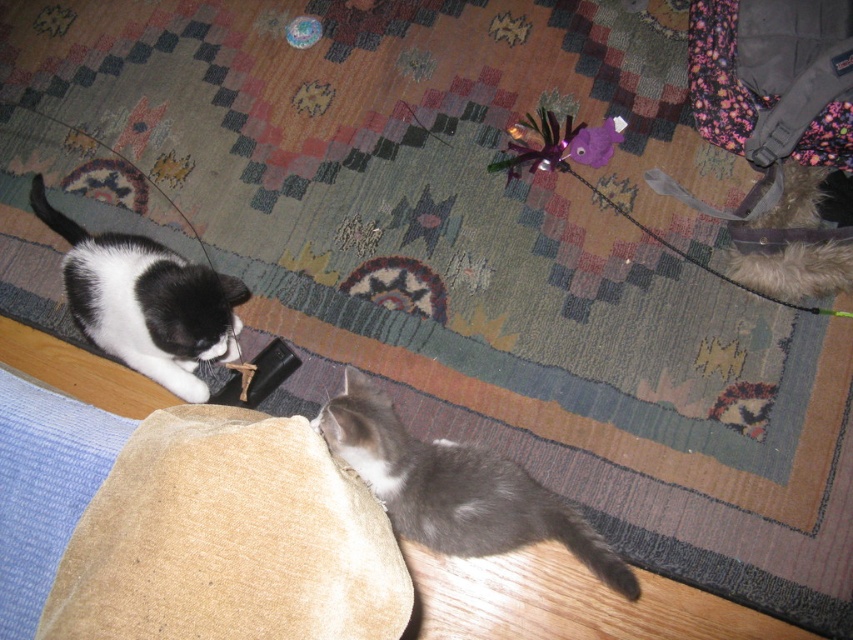
Question: Is gray fluffy cat at lower right to the right of black matte fur cat at left from the viewer's perspective?

Choices:
 (A) yes
 (B) no

Answer: (A)

Question: Does gray fluffy cat at lower right appear over black matte fur cat at left?

Choices:
 (A) no
 (B) yes

Answer: (A)

Question: Which of the following is the farthest from the observer?

Choices:
 (A) (206, 337)
 (B) (534, 531)

Answer: (A)

Question: Does gray fluffy cat at lower right appear over black matte fur cat at left?

Choices:
 (A) yes
 (B) no

Answer: (B)